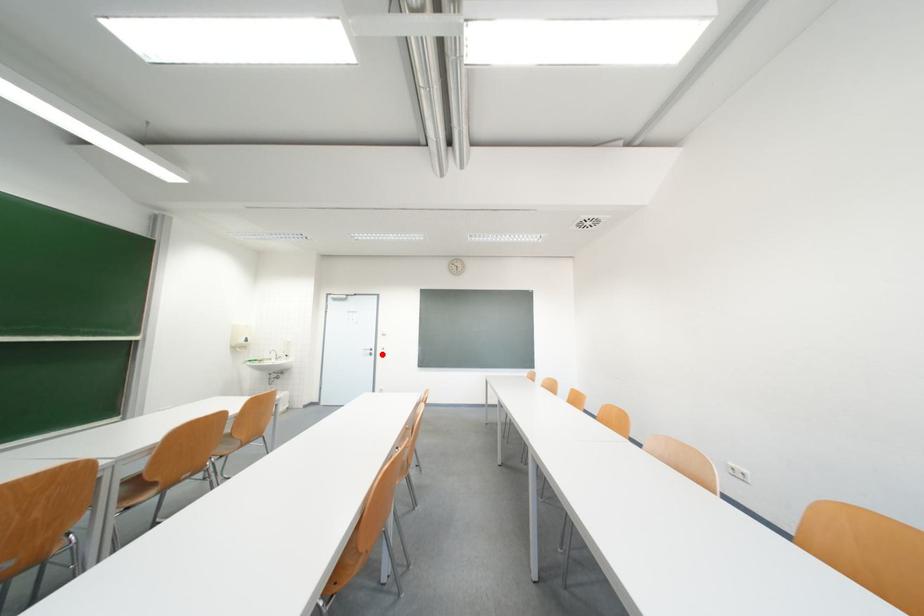
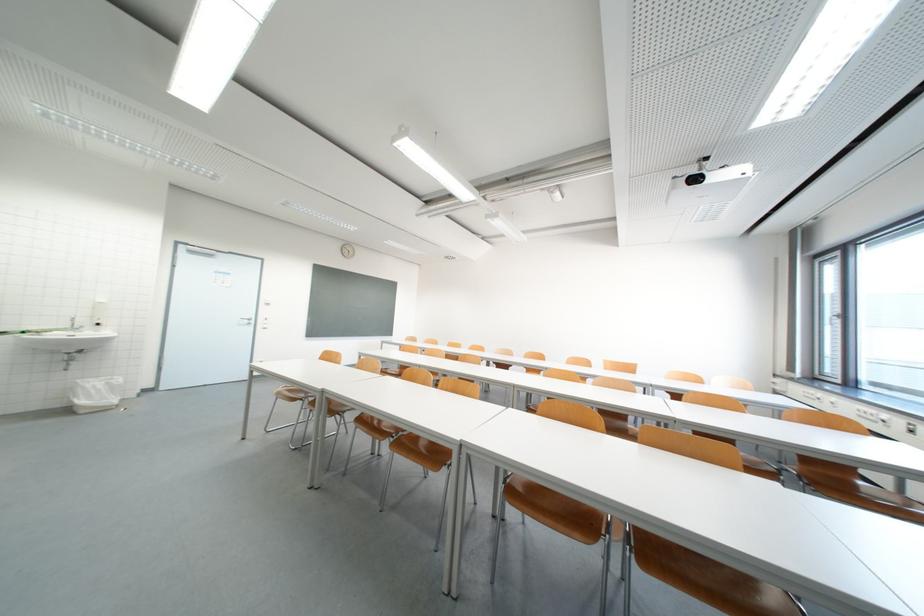
Find the pixel in the second image that matches the highlighted location in the first image.

(261, 323)